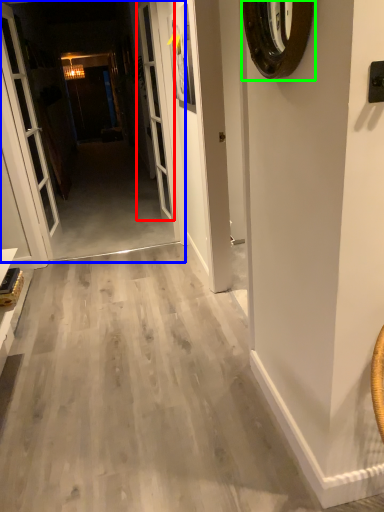
Question: Considering the real-world distances, which object is closest to screen door (highlighted by a red box)? corridor (highlighted by a blue box) or clock (highlighted by a green box).

Choices:
 (A) corridor
 (B) clock

Answer: (A)